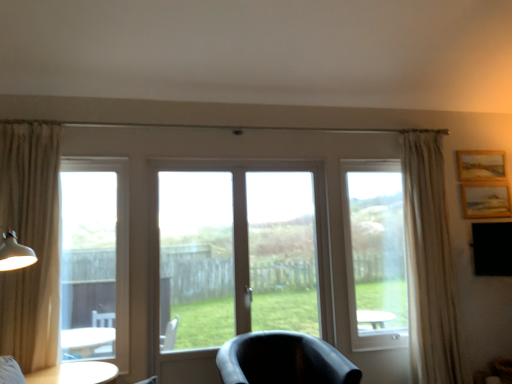
Question: Does wooden textured picture frame at upper right, the first picture frame ordered from the bottom, have a lesser height compared to clear glass window at left?

Choices:
 (A) yes
 (B) no

Answer: (A)

Question: Is wooden textured picture frame at upper right, the first picture frame ordered from the bottom, oriented towards clear glass window at left?

Choices:
 (A) yes
 (B) no

Answer: (B)

Question: From the image's perspective, does wooden textured picture frame at upper right, positioned as the second picture frame in top-to-bottom order, appear lower than clear glass window at left?

Choices:
 (A) yes
 (B) no

Answer: (B)

Question: Is wooden textured picture frame at upper right, positioned as the second picture frame in top-to-bottom order, thinner than clear glass window at left?

Choices:
 (A) yes
 (B) no

Answer: (A)

Question: Is wooden textured picture frame at upper right, the first picture frame ordered from the bottom, wider than clear glass window at left?

Choices:
 (A) yes
 (B) no

Answer: (B)

Question: Based on their sizes in the image, would you say wooden textured picture frame at upper right, positioned as the second picture frame in top-to-bottom order, is bigger or smaller than matte black chair at center?

Choices:
 (A) big
 (B) small

Answer: (B)

Question: Considering the positions of wooden textured picture frame at upper right, positioned as the second picture frame in top-to-bottom order, and matte black chair at center in the image, is wooden textured picture frame at upper right, positioned as the second picture frame in top-to-bottom order, wider or thinner than matte black chair at center?

Choices:
 (A) wide
 (B) thin

Answer: (B)

Question: Considering the positions of wooden textured picture frame at upper right, the first picture frame ordered from the bottom, and matte black chair at center in the image, is wooden textured picture frame at upper right, the first picture frame ordered from the bottom, taller or shorter than matte black chair at center?

Choices:
 (A) tall
 (B) short

Answer: (B)

Question: From a real-world perspective, is wooden textured picture frame at upper right, the first picture frame ordered from the bottom, above or below matte black chair at center?

Choices:
 (A) above
 (B) below

Answer: (A)

Question: In the image, is transparent glass window at right positioned in front of or behind matte white table lamp at left?

Choices:
 (A) front
 (B) behind

Answer: (B)

Question: From a real-world perspective, is transparent glass window at right physically located above or below matte white table lamp at left?

Choices:
 (A) above
 (B) below

Answer: (A)

Question: In terms of width, does transparent glass window at right look wider or thinner when compared to matte white table lamp at left?

Choices:
 (A) thin
 (B) wide

Answer: (A)

Question: From the image's perspective, is transparent glass window at right located above or below matte white table lamp at left?

Choices:
 (A) above
 (B) below

Answer: (A)

Question: Is matte black chair at center in front of or behind clear glass window at left in the image?

Choices:
 (A) front
 (B) behind

Answer: (A)

Question: Looking at their shapes, would you say matte black chair at center is wider or thinner than clear glass window at left?

Choices:
 (A) wide
 (B) thin

Answer: (A)